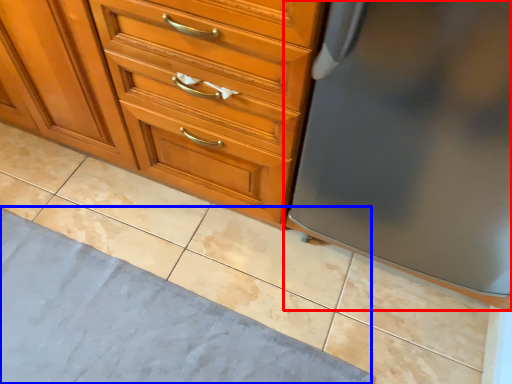
Question: Which point is closer to the camera, refrigerator (highlighted by a red box) or bath mat (highlighted by a blue box)?

Choices:
 (A) refrigerator
 (B) bath mat

Answer: (A)